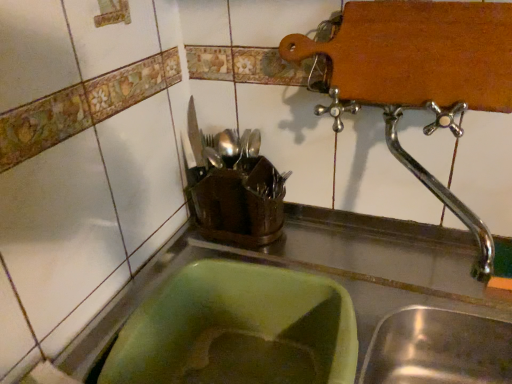
Question: Considering the relative sizes of green plastic sink at lower left and metallic knife at upper center, which ranks as the 2th tableware in right-to-left order, in the image provided, is green plastic sink at lower left shorter than metallic knife at upper center, which ranks as the 2th tableware in right-to-left order,?

Choices:
 (A) yes
 (B) no

Answer: (B)

Question: From the image's perspective, is green plastic sink at lower left on metallic knife at upper center, marked as the 1th tableware in a left-to-right arrangement?

Choices:
 (A) no
 (B) yes

Answer: (A)

Question: Is metallic knife at upper center, which ranks as the 2th tableware in right-to-left order, inside green plastic sink at lower left?

Choices:
 (A) no
 (B) yes

Answer: (A)

Question: Considering the relative sizes of green plastic sink at lower left and metallic knife at upper center, which ranks as the 2th tableware in right-to-left order, in the image provided, is green plastic sink at lower left taller than metallic knife at upper center, which ranks as the 2th tableware in right-to-left order,?

Choices:
 (A) no
 (B) yes

Answer: (B)

Question: Is green plastic sink at lower left thinner than metallic knife at upper center, marked as the 1th tableware in a left-to-right arrangement?

Choices:
 (A) yes
 (B) no

Answer: (B)

Question: Does green plastic sink at lower left have a smaller size compared to metallic knife at upper center, which ranks as the 2th tableware in right-to-left order?

Choices:
 (A) yes
 (B) no

Answer: (B)

Question: Is metallic knife at upper center, marked as the 1th tableware in a left-to-right arrangement, facing towards shiny silver cutlery at center, the 1th tableware from the right?

Choices:
 (A) no
 (B) yes

Answer: (A)

Question: Is metallic knife at upper center, marked as the 1th tableware in a left-to-right arrangement, wider than shiny silver cutlery at center, the 1th tableware from the right?

Choices:
 (A) yes
 (B) no

Answer: (A)

Question: Is metallic knife at upper center, which ranks as the 2th tableware in right-to-left order, thinner than shiny silver cutlery at center, the 1th tableware from the right?

Choices:
 (A) no
 (B) yes

Answer: (A)

Question: Does metallic knife at upper center, marked as the 1th tableware in a left-to-right arrangement, come in front of shiny silver cutlery at center, marked as the 2th tableware in a left-to-right arrangement?

Choices:
 (A) no
 (B) yes

Answer: (A)

Question: Is metallic knife at upper center, which ranks as the 2th tableware in right-to-left order, smaller than shiny silver cutlery at center, marked as the 2th tableware in a left-to-right arrangement?

Choices:
 (A) yes
 (B) no

Answer: (B)

Question: Is metallic knife at upper center, which ranks as the 2th tableware in right-to-left order, further to camera compared to shiny silver cutlery at center, the 1th tableware from the right?

Choices:
 (A) yes
 (B) no

Answer: (A)

Question: From a real-world perspective, is polished chrome tap at upper right under green plastic sink at lower left?

Choices:
 (A) no
 (B) yes

Answer: (A)